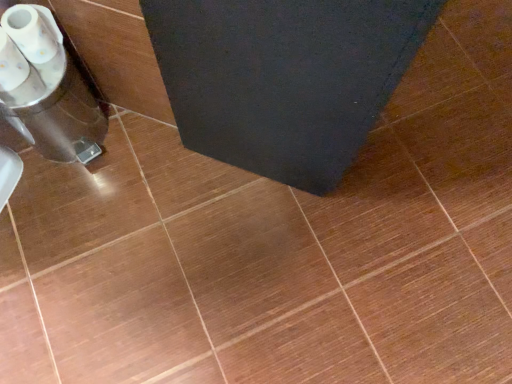
Question: Looking at their shapes, would you say translucent plastic cups at left is wider or thinner than white glossy toilet paper at lower left?

Choices:
 (A) thin
 (B) wide

Answer: (B)

Question: Is translucent plastic cups at left inside or outside of white glossy toilet paper at lower left?

Choices:
 (A) outside
 (B) inside

Answer: (A)

Question: Based on their positions, is translucent plastic cups at left located to the left or right of white glossy toilet paper at lower left?

Choices:
 (A) right
 (B) left

Answer: (B)

Question: In the image, is white glossy toilet paper at lower left positioned in front of or behind translucent plastic cups at left?

Choices:
 (A) front
 (B) behind

Answer: (A)

Question: Considering the relative positions of white glossy toilet paper at lower left and translucent plastic cups at left in the image provided, is white glossy toilet paper at lower left to the left or to the right of translucent plastic cups at left?

Choices:
 (A) right
 (B) left

Answer: (A)

Question: Based on their sizes in the image, would you say white glossy toilet paper at lower left is bigger or smaller than translucent plastic cups at left?

Choices:
 (A) small
 (B) big

Answer: (A)

Question: In terms of height, does white glossy toilet paper at lower left look taller or shorter compared to translucent plastic cups at left?

Choices:
 (A) tall
 (B) short

Answer: (B)